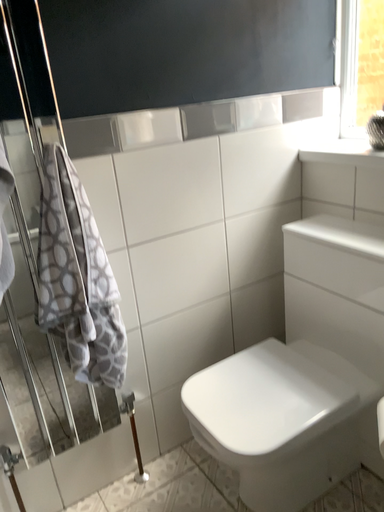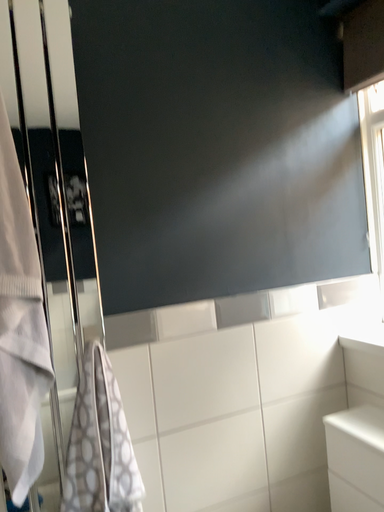
Question: Which way did the camera rotate in the video?

Choices:
 (A) rotated right
 (B) rotated left

Answer: (B)